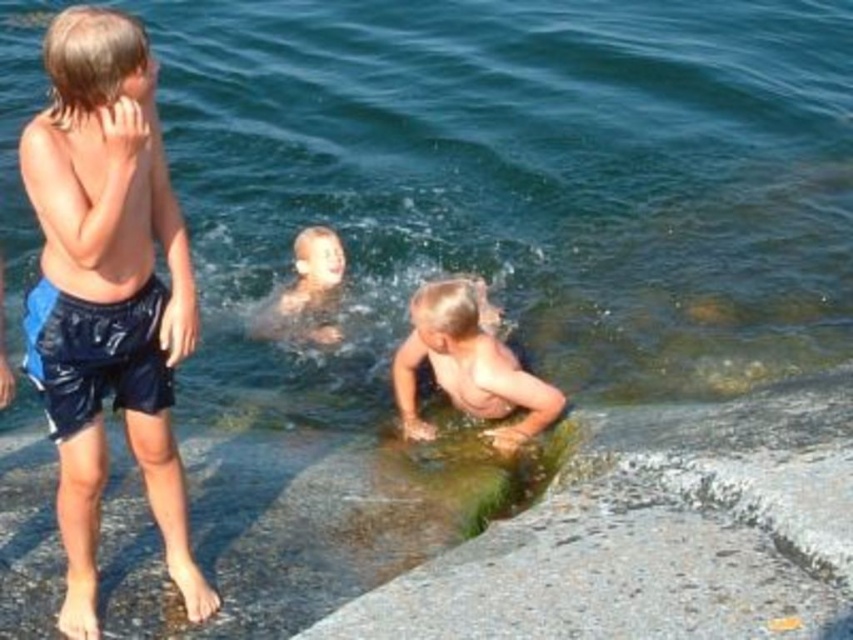
You are a photographer trying to capture a clear shot of the blue shiny shorts at left without the green mossy rock at lower center blocking the view. Based on their positions, can you move to the right or left to achieve this?

The green mossy rock at lower center is in front of the blue shiny shorts at left, so moving to the right would allow you to avoid the rock and get a clear view of the blue shiny shorts at left.